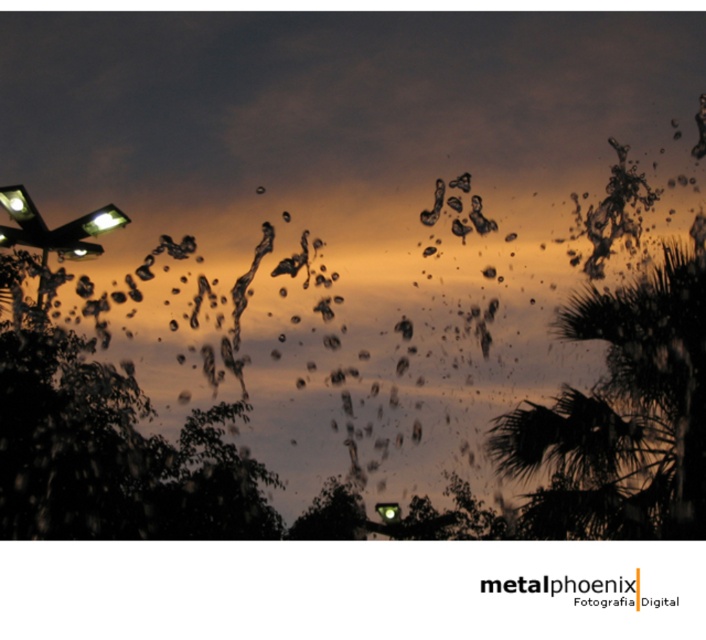
You are standing in the park and see the green leafy palm tree at center. If you want to take a closer photo of it, should you move forward or backward?

The green leafy palm tree at center is 28.77 meters away from camera. To take a closer photo, you should move forward towards it.

You are a photographer trying to capture the metallic shiny bird at center and the green leafy palm tree at center in the same frame. Based on their sizes, which object would appear smaller in your photo?

The green leafy palm tree at center would appear smaller in the photo since its width is less than the metallic shiny bird at center.

You are a pedestrian standing at the crosswalk and see the green leafy palm tree at center and the green glass traffic light at center. Which object is closer to the ground?

The green glass traffic light at center is closer to the ground because the green leafy palm tree at center is positioned over it.